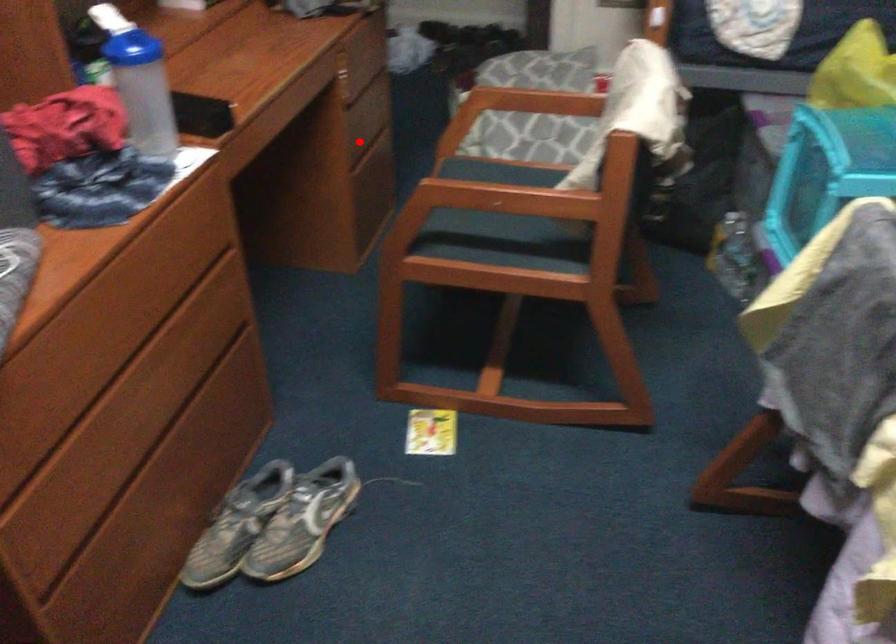
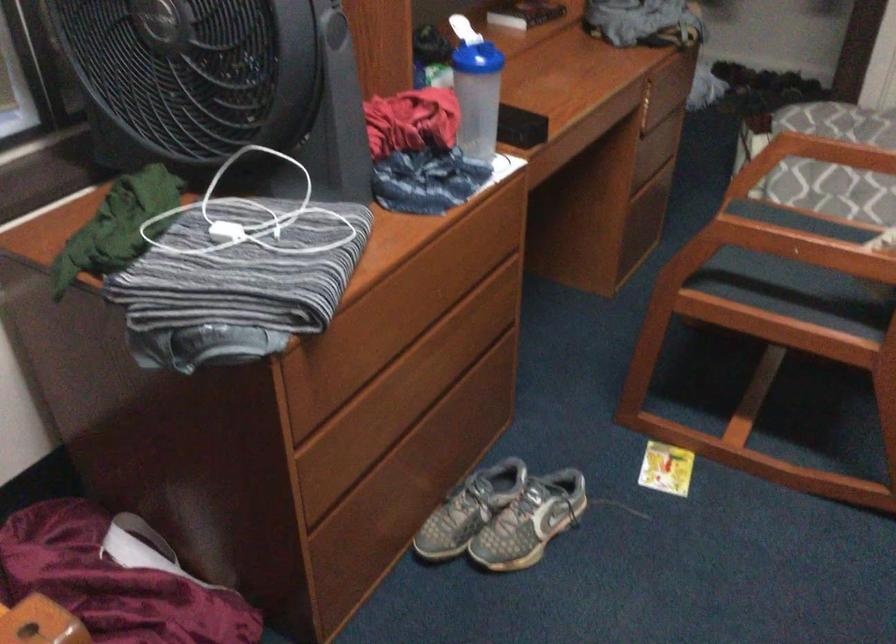
The point at the highlighted location is marked in the first image. Where is the corresponding point in the second image?

(643, 169)